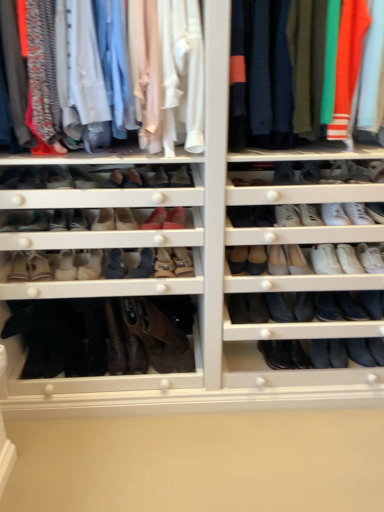
You are a GUI agent. You are given a task and a screenshot of the screen. Output one action in this format:
    pyautogui.click(x=<x>, y=<y>)
    Task: Click on the matte pink leather shoe at center, which is the 9th shoe from right to left
    
    Given the screenshot: What is the action you would take?
    pyautogui.click(x=125, y=219)

This screenshot has width=384, height=512. Describe the element at coordinates (82, 178) in the screenshot. I see `matte pink leather shoe at center, marked as the eleventh shoe in a right-to-left arrangement` at that location.

Where is `suede brown boot at lower left, which appears as the thirteenth shoe when viewed from the right`? This screenshot has height=512, width=384. suede brown boot at lower left, which appears as the thirteenth shoe when viewed from the right is located at coordinates (38, 266).

How much space does black leather boot at lower right, acting as the 3th shoe starting from the right, occupy vertically?

2.51 inches.

The height and width of the screenshot is (512, 384). Describe the element at coordinates (10, 178) in the screenshot. I see `matte black boot at lower left, arranged as the 14th shoe when viewed from the right` at that location.

The image size is (384, 512). Identify the location of matte pink shoe at center, marked as the eighth shoe in a left-to-right arrangement. (181, 177).

Looking at this image, is black leather boot at lower right, acting as the 3th shoe starting from the right, far from white leather sneaker at center-right, which is counted as the fifth shoe, starting from the right?

No.

Is point (324, 346) in front of point (284, 222)?

No, (324, 346) is further to viewer.

Considering the sizes of black leather boot at lower right, acting as the 3th shoe starting from the right, and white leather sneaker at center-right, which is counted as the fifth shoe, starting from the right, in the image, is black leather boot at lower right, acting as the 3th shoe starting from the right, wider or thinner than white leather sneaker at center-right, which is counted as the fifth shoe, starting from the right,?

In the image, black leather boot at lower right, acting as the 3th shoe starting from the right, appears to be wider than white leather sneaker at center-right, which is counted as the fifth shoe, starting from the right.

Is black leather boot at lower right, acting as the 3th shoe starting from the right, oriented towards white leather sneaker at center-right, which is counted as the fifth shoe, starting from the right?

No, black leather boot at lower right, acting as the 3th shoe starting from the right, is not turned towards white leather sneaker at center-right, which is counted as the fifth shoe, starting from the right.

Between point (133, 227) and point (181, 181), which one is positioned behind?

Positioned behind is point (133, 227).

Are matte pink leather shoe at center, the 6th shoe viewed from the left, and matte pink shoe at center, marked as the 7th shoe in a right-to-left arrangement, far apart?

That's not correct — matte pink leather shoe at center, the 6th shoe viewed from the left, is a little close to matte pink shoe at center, marked as the 7th shoe in a right-to-left arrangement.

Who is bigger, matte pink leather shoe at center, which is the 9th shoe from right to left, or matte pink shoe at center, marked as the eighth shoe in a left-to-right arrangement?

matte pink leather shoe at center, which is the 9th shoe from right to left.

Does matte pink leather shoe at center, which is the 9th shoe from right to left, appear on the left side of matte pink shoe at center, marked as the eighth shoe in a left-to-right arrangement?

Correct, you'll find matte pink leather shoe at center, which is the 9th shoe from right to left, to the left of matte pink shoe at center, marked as the eighth shoe in a left-to-right arrangement.

From the image's perspective, is white leather sneaker at center-right, which is counted as the fifth shoe, starting from the right, under black leather boot at lower center, which is the 2th shoe in right-to-left order?

No, from the image's perspective, white leather sneaker at center-right, which is counted as the fifth shoe, starting from the right, is not beneath black leather boot at lower center, which is the 2th shoe in right-to-left order.

The height and width of the screenshot is (512, 384). What are the coordinates of `the 6th shoe behind the white leather sneaker at center-right, which is counted as the fifth shoe, starting from the right, counting from the anchor's position` in the screenshot? It's located at pyautogui.click(x=338, y=353).

Measure the distance from white leather sneaker at center-right, acting as the 10th shoe starting from the left, to black leather boot at lower center, which is the 2th shoe in right-to-left order.

white leather sneaker at center-right, acting as the 10th shoe starting from the left, is 28.86 inches away from black leather boot at lower center, which is the 2th shoe in right-to-left order.

Based on the photo, is white leather sneaker at center-right, which is counted as the fifth shoe, starting from the right, shorter than black leather boot at lower center, the 13th shoe in the left-to-right sequence?

No, white leather sneaker at center-right, which is counted as the fifth shoe, starting from the right, is not shorter than black leather boot at lower center, the 13th shoe in the left-to-right sequence.

Considering the positions of objects suede beige boot at center, which is the 6th shoe in right-to-left order, and pink leather shoe at center, marked as the 7th shoe in a left-to-right arrangement, in the image provided, who is in front, suede beige boot at center, which is the 6th shoe in right-to-left order, or pink leather shoe at center, marked as the 7th shoe in a left-to-right arrangement,?

pink leather shoe at center, marked as the 7th shoe in a left-to-right arrangement, is in front.

Is suede beige boot at center, which is the 6th shoe in right-to-left order, inside or outside of pink leather shoe at center, acting as the eighth shoe starting from the right?

suede beige boot at center, which is the 6th shoe in right-to-left order, cannot be found inside pink leather shoe at center, acting as the eighth shoe starting from the right.

Considering the positions of objects suede beige boot at center, which is counted as the 9th shoe, starting from the left, and pink leather shoe at center, marked as the 7th shoe in a left-to-right arrangement, in the image provided, who is more to the right, suede beige boot at center, which is counted as the 9th shoe, starting from the left, or pink leather shoe at center, marked as the 7th shoe in a left-to-right arrangement,?

suede beige boot at center, which is counted as the 9th shoe, starting from the left.

Which of these two, suede beige boot at center, which is the 6th shoe in right-to-left order, or pink leather shoe at center, acting as the eighth shoe starting from the right, is bigger?

Bigger between the two is suede beige boot at center, which is the 6th shoe in right-to-left order.

Which object is further away from the camera taking this photo, suede beige boot at center, the third shoe viewed from the left, or knit sweater at upper right, which is the second clothing from left to right?

suede beige boot at center, the third shoe viewed from the left, is more distant.

This screenshot has height=512, width=384. Identify the location of the 2nd clothing above the suede beige boot at center, arranged as the 12th shoe when viewed from the right (from a real-world perspective). (264, 78).

Is suede beige boot at center, the third shoe viewed from the left, turned away from knit sweater at upper right, which is the second clothing from left to right?

No.

Is suede beige boot at center, the third shoe viewed from the left, with knit sweater at upper right, which is the second clothing from left to right?

suede beige boot at center, the third shoe viewed from the left, and knit sweater at upper right, which is the second clothing from left to right, are clearly separated.

Can you confirm if matte black boot at lower left, the first shoe in the left-to-right sequence, is positioned to the left of matte pink leather shoe at center, marked as the eleventh shoe in a right-to-left arrangement?

Yes, matte black boot at lower left, the first shoe in the left-to-right sequence, is to the left of matte pink leather shoe at center, marked as the eleventh shoe in a right-to-left arrangement.

Is matte black boot at lower left, arranged as the 14th shoe when viewed from the right, in front of or behind matte pink leather shoe at center, marked as the eleventh shoe in a right-to-left arrangement, in the image?

matte black boot at lower left, arranged as the 14th shoe when viewed from the right, is positioned closer to the viewer than matte pink leather shoe at center, marked as the eleventh shoe in a right-to-left arrangement.

Between point (16, 176) and point (86, 183), which one is positioned behind?

Positioned behind is point (16, 176).

Considering the sizes of matte black boot at lower left, the first shoe in the left-to-right sequence, and matte pink leather shoe at center, arranged as the 4th shoe when viewed from the left, in the image, is matte black boot at lower left, the first shoe in the left-to-right sequence, taller or shorter than matte pink leather shoe at center, arranged as the 4th shoe when viewed from the left,?

matte black boot at lower left, the first shoe in the left-to-right sequence, is shorter than matte pink leather shoe at center, arranged as the 4th shoe when viewed from the left.

Is matte black boot at lower left, the first shoe in the left-to-right sequence, positioned far away from matte pink leather shoe at center, placed as the 5th shoe when sorted from left to right?

Actually, matte black boot at lower left, the first shoe in the left-to-right sequence, and matte pink leather shoe at center, placed as the 5th shoe when sorted from left to right, are a little close together.

In terms of width, does matte black boot at lower left, arranged as the 14th shoe when viewed from the right, look wider or thinner when compared to matte pink leather shoe at center, acting as the 10th shoe starting from the right?

In the image, matte black boot at lower left, arranged as the 14th shoe when viewed from the right, appears to be wider than matte pink leather shoe at center, acting as the 10th shoe starting from the right.

Based on the photo, can you tell me how much matte black boot at lower left, the first shoe in the left-to-right sequence, and matte pink leather shoe at center, acting as the 10th shoe starting from the right, differ in facing direction?

3.4 degrees.

Is the position of matte black boot at lower left, the first shoe in the left-to-right sequence, more distant than that of matte pink leather shoe at center, placed as the 5th shoe when sorted from left to right?

No, it is in front of matte pink leather shoe at center, placed as the 5th shoe when sorted from left to right.

This screenshot has width=384, height=512. Find the location of `the 5th shoe positioned above the black leather boot at lower right, which ranks as the 12th shoe in left-to-right order (from a real-world perspective)`. the 5th shoe positioned above the black leather boot at lower right, which ranks as the 12th shoe in left-to-right order (from a real-world perspective) is located at coordinates (287, 216).

At what (x,y) coordinates should I click in order to perform the action: click on shoe that is the 6th one when counting upward from the matte pink leather shoe at center, the 6th shoe viewed from the left (from the image's perspective). Please return your answer as a coordinate pair (x, y). Image resolution: width=384 pixels, height=512 pixels. Looking at the image, I should click on (181, 177).

Considering their positions, is matte pink leather shoe at center, marked as the eleventh shoe in a right-to-left arrangement, positioned closer to knit sweater at upper right, the first clothing in the right-to-left sequence, than matte pink leather shoe at center, placed as the 5th shoe when sorted from left to right?

matte pink leather shoe at center, placed as the 5th shoe when sorted from left to right, is closer to knit sweater at upper right, the first clothing in the right-to-left sequence.

Based on their spatial positions, is brown suede boot at center or black leather boot at lower right, acting as the 3th shoe starting from the right, closer to matte pink shoe at center, marked as the 7th shoe in a right-to-left arrangement?

brown suede boot at center is closer to matte pink shoe at center, marked as the 7th shoe in a right-to-left arrangement.

Considering their positions, is suede brown boot at lower left, placed as the 2th shoe when sorted from left to right, positioned closer to white leather sneaker at center-right, which is counted as the fifth shoe, starting from the right, than matte pink leather shoe at center, the 6th shoe viewed from the left?

Among the two, matte pink leather shoe at center, the 6th shoe viewed from the left, is located nearer to white leather sneaker at center-right, which is counted as the fifth shoe, starting from the right.

Which object lies further to the anchor point suede beige boot at center, the third shoe viewed from the left, pink leather shoe at center, acting as the eighth shoe starting from the right, or white leather sneaker at center-right, acting as the 10th shoe starting from the left?

white leather sneaker at center-right, acting as the 10th shoe starting from the left.

Looking at the image, which one is located further to matte black boot at lower left, the first shoe in the left-to-right sequence, suede brown boot at lower left, which appears as the thirteenth shoe when viewed from the right, or matte cotton shirts at upper left, which is the 2th clothing from right to left?

matte cotton shirts at upper left, which is the 2th clothing from right to left, is further to matte black boot at lower left, the first shoe in the left-to-right sequence.

From the image, which object appears to be farther from white leather sneaker at center-right, which is counted as the fifth shoe, starting from the right, brown suede boot at center or suede beige boot at center, arranged as the 12th shoe when viewed from the right?

suede beige boot at center, arranged as the 12th shoe when viewed from the right, is further to white leather sneaker at center-right, which is counted as the fifth shoe, starting from the right.

Considering their positions, is white leather sneaker at center right, the eleventh shoe in the left-to-right sequence, positioned closer to suede brown boot at lower left, which appears as the thirteenth shoe when viewed from the right, than suede beige boot at center, which is the 6th shoe in right-to-left order?

suede beige boot at center, which is the 6th shoe in right-to-left order.

From the image, which object appears to be nearer to knit sweater at upper right, the first clothing in the right-to-left sequence, white leather sneaker at center-right, acting as the 10th shoe starting from the left, or white leather sneaker at center right, which is the 4th shoe in right-to-left order?

white leather sneaker at center-right, acting as the 10th shoe starting from the left, lies closer to knit sweater at upper right, the first clothing in the right-to-left sequence, than the other object.

In order to click on footwear located between matte black boot at lower left, the first shoe in the left-to-right sequence, and black suede boot at lower right, the 1th shoe positioned from the right, in the left-right direction in this screenshot , I will do `click(158, 336)`.

Locate an element on the screen. The image size is (384, 512). clothing situated between suede beige boot at center, arranged as the 12th shoe when viewed from the right, and white leather sneaker at center-right, acting as the 10th shoe starting from the left, from left to right is located at coordinates (171, 64).

Locate an element on the screen. The height and width of the screenshot is (512, 384). footwear located between matte pink leather shoe at center, which is the 9th shoe from right to left, and black leather boot at lower center, which is the 2th shoe in right-to-left order, in the left-right direction is located at coordinates (158, 336).

Identify the location of footwear located between pink leather shoe at center, acting as the eighth shoe starting from the right, and black leather boot at lower center, the 13th shoe in the left-to-right sequence, in the left-right direction. The image size is (384, 512). (158, 336).